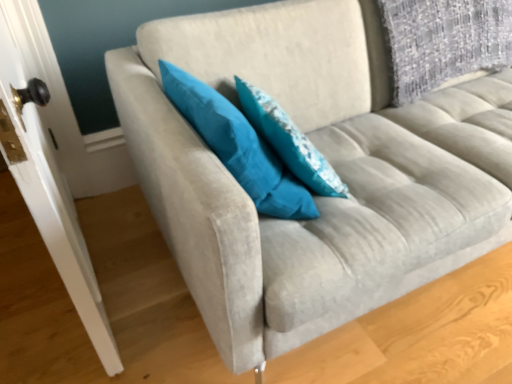
The width and height of the screenshot is (512, 384). I want to click on teal fabric pillow at center, the 1th pillow in the left-to-right sequence, so click(238, 146).

Describe the element at coordinates (289, 141) in the screenshot. The image size is (512, 384). I see `teal fabric pillow at center, which is the first pillow from right to left` at that location.

The image size is (512, 384). What are the coordinates of `teal fabric pillow at center, the 1th pillow in the left-to-right sequence` in the screenshot? It's located at (238, 146).

Which point is more forward, [55,236] or [305,156]?

The point [55,236] is closer.

Find the location of `the 2nd pillow behind the white glossy door handle at left`. the 2nd pillow behind the white glossy door handle at left is located at coordinates coord(289,141).

Considering the relative sizes of white glossy door handle at left and teal fabric pillow at center, which is the first pillow from right to left, in the image provided, is white glossy door handle at left thinner than teal fabric pillow at center, which is the first pillow from right to left,?

Correct, the width of white glossy door handle at left is less than that of teal fabric pillow at center, which is the first pillow from right to left.

Does white glossy door handle at left touch teal fabric pillow at center, the 2th pillow viewed from the left?

white glossy door handle at left and teal fabric pillow at center, the 2th pillow viewed from the left, are not in contact.

Is teal fabric pillow at center, the 1th pillow in the left-to-right sequence, wider than teal fabric pillow at center, which is the first pillow from right to left?

Yes.

Could you measure the distance between teal fabric pillow at center, the 1th pillow in the left-to-right sequence, and teal fabric pillow at center, which is the first pillow from right to left?

The distance of teal fabric pillow at center, the 1th pillow in the left-to-right sequence, from teal fabric pillow at center, which is the first pillow from right to left, is 4.15 inches.

Is teal fabric pillow at center, the 1th pillow in the left-to-right sequence, located outside teal fabric pillow at center, the 2th pillow viewed from the left?

That's correct, teal fabric pillow at center, the 1th pillow in the left-to-right sequence, is outside of teal fabric pillow at center, the 2th pillow viewed from the left.

Is teal fabric pillow at center, the 1th pillow in the left-to-right sequence, facing towards teal fabric pillow at center, the 2th pillow viewed from the left?

Yes, teal fabric pillow at center, the 1th pillow in the left-to-right sequence, is turned towards teal fabric pillow at center, the 2th pillow viewed from the left.

Can you confirm if teal fabric pillow at center, the 1th pillow in the left-to-right sequence, is smaller than white glossy door handle at left?

Indeed, teal fabric pillow at center, the 1th pillow in the left-to-right sequence, has a smaller size compared to white glossy door handle at left.

Between teal fabric pillow at center, placed as the second pillow when sorted from right to left, and white glossy door handle at left, which one is positioned in front?

white glossy door handle at left is closer to the camera.

The image size is (512, 384). Find the location of `pillow that is the 1st one when counting rightward from the white glossy door handle at left`. pillow that is the 1st one when counting rightward from the white glossy door handle at left is located at coordinates (238, 146).

Does teal fabric pillow at center, placed as the second pillow when sorted from right to left, touch white glossy door handle at left?

No, teal fabric pillow at center, placed as the second pillow when sorted from right to left, is not making contact with white glossy door handle at left.

Considering the relative positions of white glossy door handle at left and teal fabric pillow at center, the 1th pillow in the left-to-right sequence, in the image provided, is white glossy door handle at left to the left of teal fabric pillow at center, the 1th pillow in the left-to-right sequence, from the viewer's perspective?

Yes, white glossy door handle at left is to the left of teal fabric pillow at center, the 1th pillow in the left-to-right sequence.

Does point (85, 271) come behind point (257, 137)?

That is False.

Is white glossy door handle at left outside of teal fabric pillow at center, the 1th pillow in the left-to-right sequence?

Yes, white glossy door handle at left is not within teal fabric pillow at center, the 1th pillow in the left-to-right sequence.

Is white glossy door handle at left smaller than teal fabric pillow at center, the 1th pillow in the left-to-right sequence?

Incorrect, white glossy door handle at left is not smaller in size than teal fabric pillow at center, the 1th pillow in the left-to-right sequence.

What's the angular difference between teal fabric pillow at center, the 2th pillow viewed from the left, and white glossy door handle at left's facing directions?

There is a 171-degree angle between the facing directions of teal fabric pillow at center, the 2th pillow viewed from the left, and white glossy door handle at left.

Is teal fabric pillow at center, the 2th pillow viewed from the left, not near white glossy door handle at left?

teal fabric pillow at center, the 2th pillow viewed from the left, is near white glossy door handle at left, not far away.

Based on the photo, can you confirm if teal fabric pillow at center, the 2th pillow viewed from the left, is positioned to the right of white glossy door handle at left?

Indeed, teal fabric pillow at center, the 2th pillow viewed from the left, is positioned on the right side of white glossy door handle at left.

Considering the relative sizes of teal fabric pillow at center, which is the first pillow from right to left, and white glossy door handle at left in the image provided, is teal fabric pillow at center, which is the first pillow from right to left, shorter than white glossy door handle at left?

Correct, teal fabric pillow at center, which is the first pillow from right to left, is not as tall as white glossy door handle at left.

Identify the location of pillow located below the teal fabric pillow at center, which is the first pillow from right to left (from the image's perspective). This screenshot has height=384, width=512. (238, 146).

From a real-world perspective, relative to teal fabric pillow at center, placed as the second pillow when sorted from right to left, is teal fabric pillow at center, which is the first pillow from right to left, vertically above or below?

teal fabric pillow at center, which is the first pillow from right to left, is situated lower than teal fabric pillow at center, placed as the second pillow when sorted from right to left, in the real world.

From the picture: Does teal fabric pillow at center, the 2th pillow viewed from the left, have a greater width compared to teal fabric pillow at center, placed as the second pillow when sorted from right to left?

In fact, teal fabric pillow at center, the 2th pillow viewed from the left, might be narrower than teal fabric pillow at center, placed as the second pillow when sorted from right to left.

Is teal fabric pillow at center, which is the first pillow from right to left, turned away from teal fabric pillow at center, the 1th pillow in the left-to-right sequence?

Yes, teal fabric pillow at center, the 1th pillow in the left-to-right sequence, is at the back of teal fabric pillow at center, which is the first pillow from right to left.

Identify the location of door below the teal fabric pillow at center, which is the first pillow from right to left (from a real-world perspective). This screenshot has width=512, height=384. (49, 169).

There is a teal fabric pillow at center, which is the first pillow from right to left. Where is `pillow above it (from a real-world perspective)`? This screenshot has width=512, height=384. pillow above it (from a real-world perspective) is located at coordinates (238, 146).

From the picture: When comparing their distances from teal fabric pillow at center, which is the first pillow from right to left, does white glossy door handle at left or teal fabric pillow at center, the 1th pillow in the left-to-right sequence, seem closer?

teal fabric pillow at center, the 1th pillow in the left-to-right sequence, is positioned closer to the anchor teal fabric pillow at center, which is the first pillow from right to left.

When comparing their distances from white glossy door handle at left, does teal fabric pillow at center, the 2th pillow viewed from the left, or teal fabric pillow at center, the 1th pillow in the left-to-right sequence, seem further?

Among the two, teal fabric pillow at center, the 2th pillow viewed from the left, is located further to white glossy door handle at left.

Estimate the real-world distances between objects in this image. Which object is further from teal fabric pillow at center, the 1th pillow in the left-to-right sequence, white glossy door handle at left or teal fabric pillow at center, which is the first pillow from right to left?

Among the two, white glossy door handle at left is located further to teal fabric pillow at center, the 1th pillow in the left-to-right sequence.

When comparing their distances from teal fabric pillow at center, placed as the second pillow when sorted from right to left, does teal fabric pillow at center, which is the first pillow from right to left, or white glossy door handle at left seem further?

The object further to teal fabric pillow at center, placed as the second pillow when sorted from right to left, is white glossy door handle at left.

Which object lies nearer to the anchor point teal fabric pillow at center, the 2th pillow viewed from the left, teal fabric pillow at center, placed as the second pillow when sorted from right to left, or white glossy door handle at left?

Among the two, teal fabric pillow at center, placed as the second pillow when sorted from right to left, is located nearer to teal fabric pillow at center, the 2th pillow viewed from the left.

Estimate the real-world distances between objects in this image. Which object is further from white glossy door handle at left, teal fabric pillow at center, the 1th pillow in the left-to-right sequence, or teal fabric pillow at center, the 2th pillow viewed from the left?

teal fabric pillow at center, the 2th pillow viewed from the left, lies further to white glossy door handle at left than the other object.

The height and width of the screenshot is (384, 512). Identify the location of pillow between white glossy door handle at left and teal fabric pillow at center, the 2th pillow viewed from the left, from left to right. (238, 146).